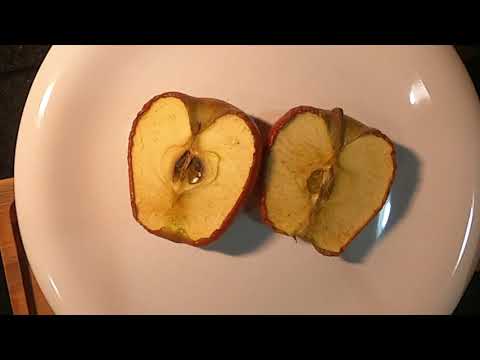
Locate an element on the screen. Image resolution: width=480 pixels, height=360 pixels. white plate is located at coordinates (236, 273).